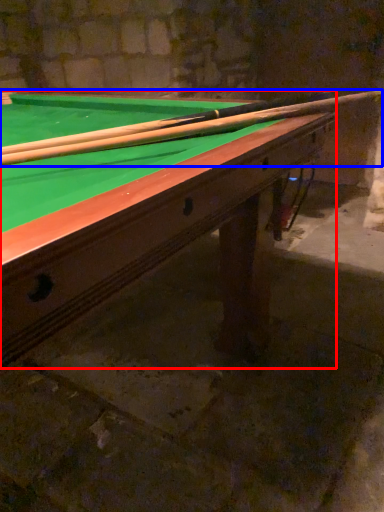
Question: Among these objects, which one is farthest to the camera, billiard table (highlighted by a red box) or cue (highlighted by a blue box)?

Choices:
 (A) billiard table
 (B) cue

Answer: (B)